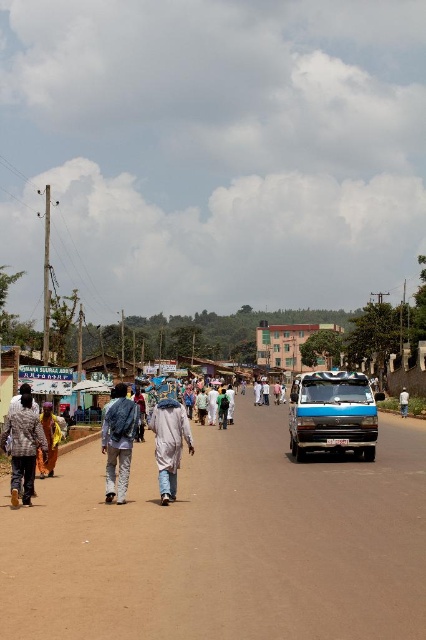
Question: Can you confirm if light gray fabric coat at center is positioned above white cotton shirt at center?

Choices:
 (A) yes
 (B) no

Answer: (A)

Question: Which point is closer to the camera?

Choices:
 (A) (368, 433)
 (B) (402, 387)

Answer: (A)

Question: Is plaid fabric shirt at lower left behind light gray fabric coat at center?

Choices:
 (A) yes
 (B) no

Answer: (B)

Question: Which is nearer to the light gray fabric coat at center?

Choices:
 (A) plaid fabric shirt at lower left
 (B) white cotton shirt at center

Answer: (A)

Question: Based on their relative distances, which object is nearer to the brown dirt track at lower center?

Choices:
 (A) light gray fabric coat at center
 (B) blue metallic van at center

Answer: (B)

Question: From the image, what is the correct spatial relationship of light gray fabric coat at center in relation to white cotton shirt at center?

Choices:
 (A) right
 (B) left

Answer: (B)